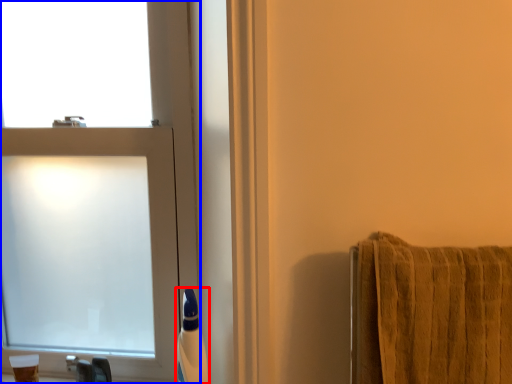
Question: Which point is closer to the camera, toiletry (highlighted by a red box) or window (highlighted by a blue box)?

Choices:
 (A) toiletry
 (B) window

Answer: (A)